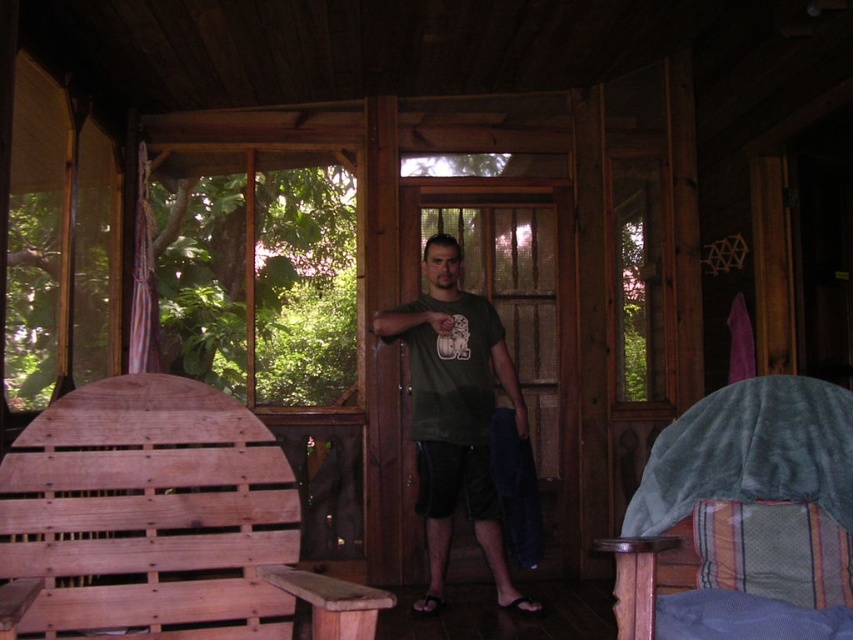
Question: Which object is positioned farthest from the wooden chair at left?

Choices:
 (A) green matte t-shirt at center
 (B) velvet green bed at right

Answer: (A)

Question: Can you confirm if velvet green bed at right is positioned to the left of green matte t-shirt at center?

Choices:
 (A) no
 (B) yes

Answer: (A)

Question: In this image, where is velvet green bed at right located relative to green matte t-shirt at center?

Choices:
 (A) above
 (B) below

Answer: (B)

Question: Can you confirm if velvet green bed at right is positioned below green matte t-shirt at center?

Choices:
 (A) no
 (B) yes

Answer: (B)

Question: Which point appears closest to the camera in this image?

Choices:
 (A) (74, 461)
 (B) (711, 563)

Answer: (A)

Question: Which of the following is the closest to the observer?

Choices:
 (A) (36, 598)
 (B) (648, 540)

Answer: (A)